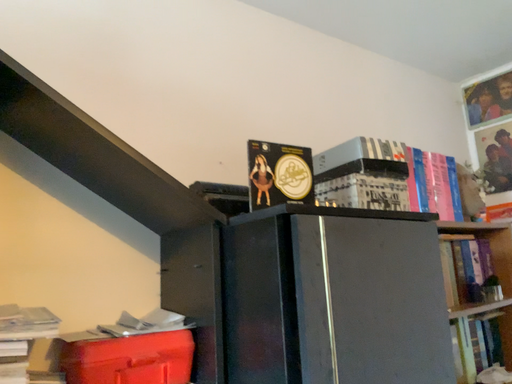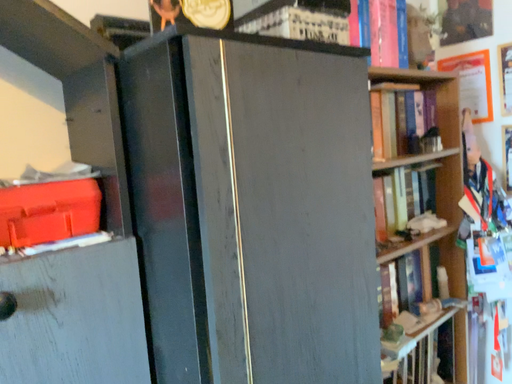
Question: Which way did the camera rotate in the video?

Choices:
 (A) rotated downward
 (B) rotated upward

Answer: (A)